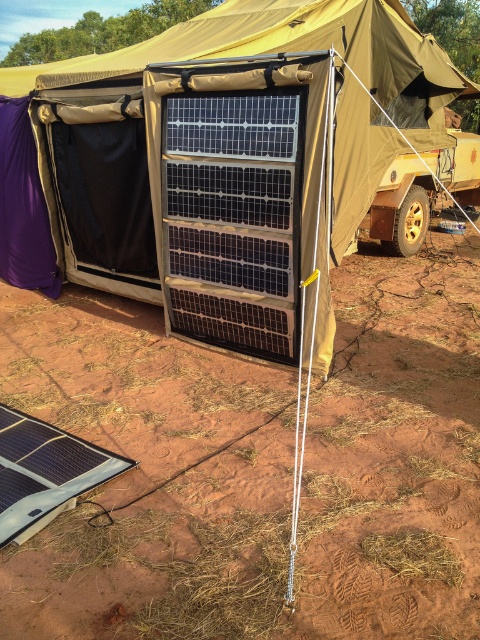
You are setting up a campsite and need to decide where to place your gear. You have two items to place on the ground at the lower left area of the campsite. The dirt at lower left and the black flexible solar panel at lower left are already there. Which item takes up more space in that area?

The black flexible solar panel at lower left takes up more space than the dirt at lower left in the lower left area of the campsite.

You are standing at the camera position and want to place a 2.5 meter long ladder on the ground. Can you fit the ladder horizontally on the dirt at lower left without it extending beyond the visible area?

The distance of dirt at lower left from camera is 2.34 meters. Since the ladder is 2.5 meters long, it would extend beyond the visible area as the available space is shorter than the ladder.